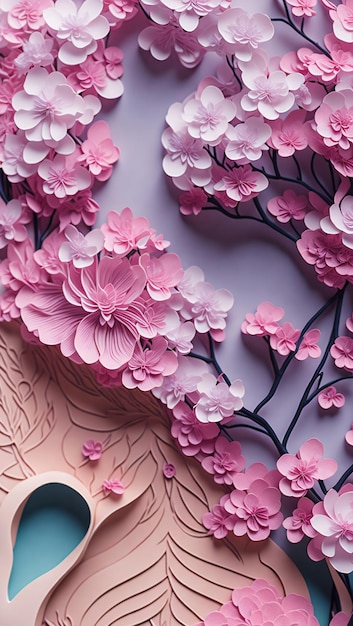
Locate an element on the screen. This screenshot has height=626, width=353. small flower is located at coordinates (112, 486), (94, 446), (165, 464), (334, 396), (189, 200), (287, 197).